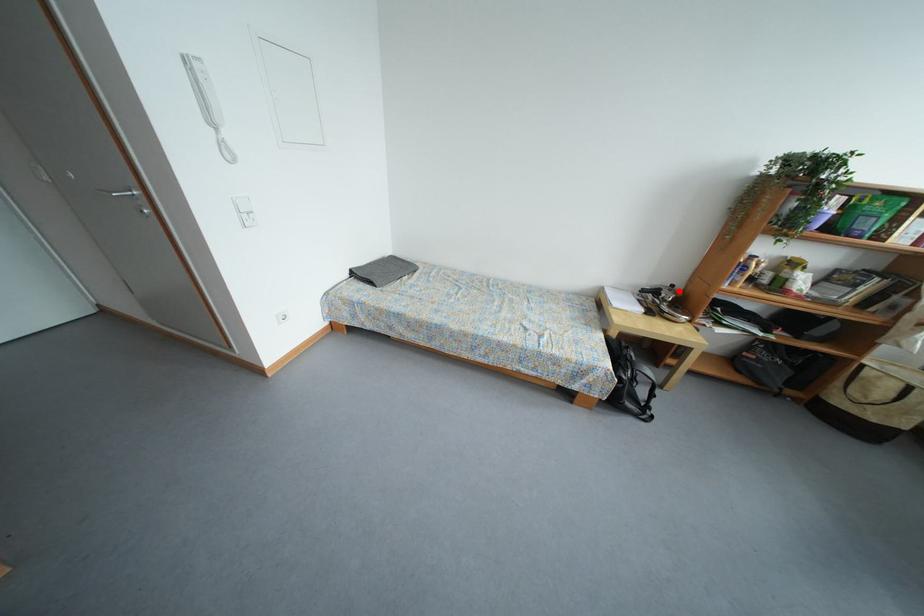
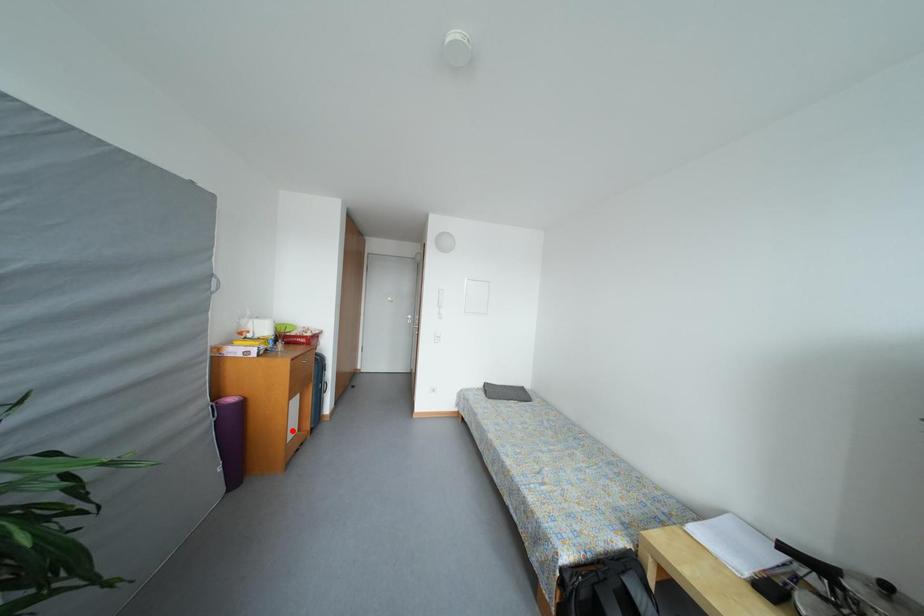
I am providing you with two images of the same scene from different viewpoints. A red point is marked on the first image and another point is marked on the second image. Does the point marked in image1 correspond to the same location as the one in image2?

No